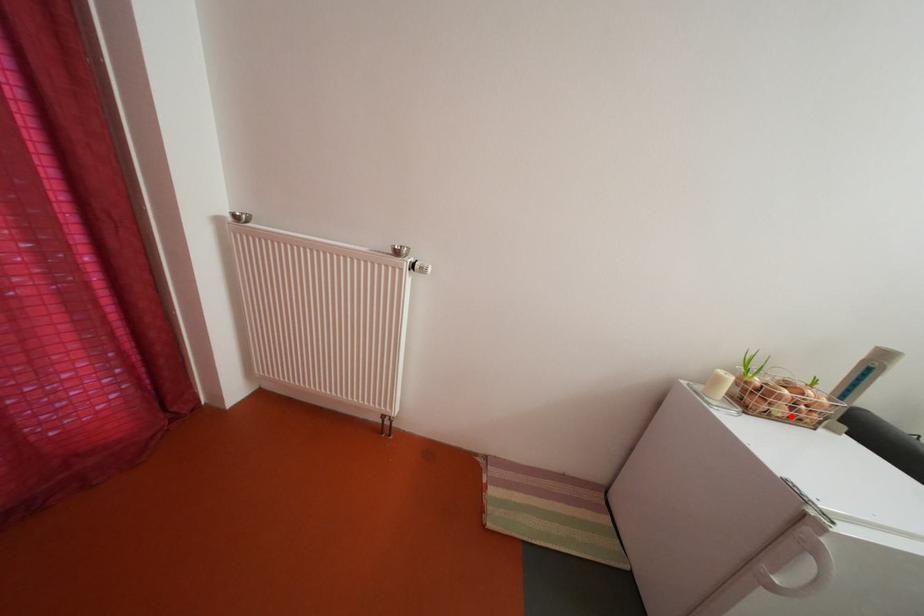
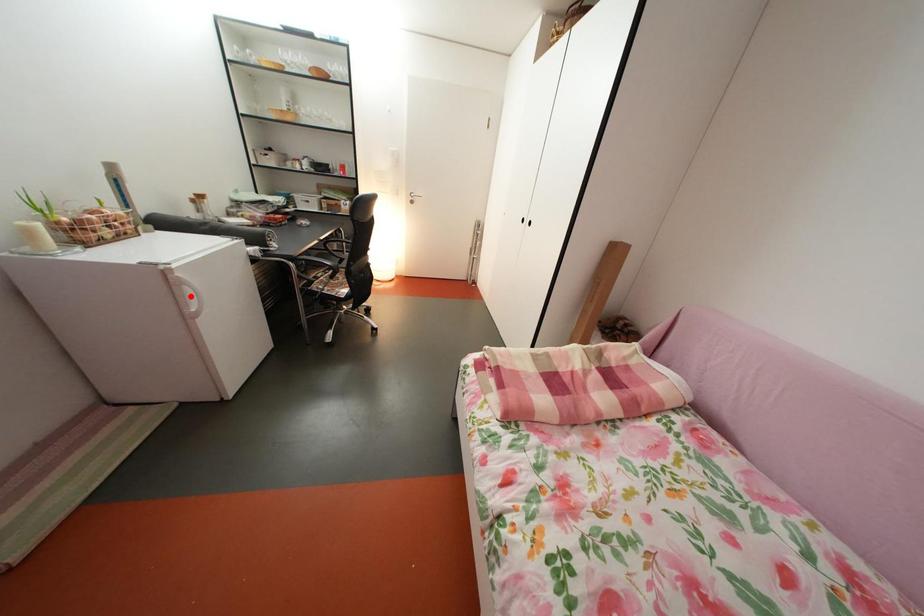
I am providing you with two images of the same scene from different viewpoints. A red point is marked on the first image and another point is marked on the second image. Are the points marked in image1 and image2 representing the same 3D position?

No